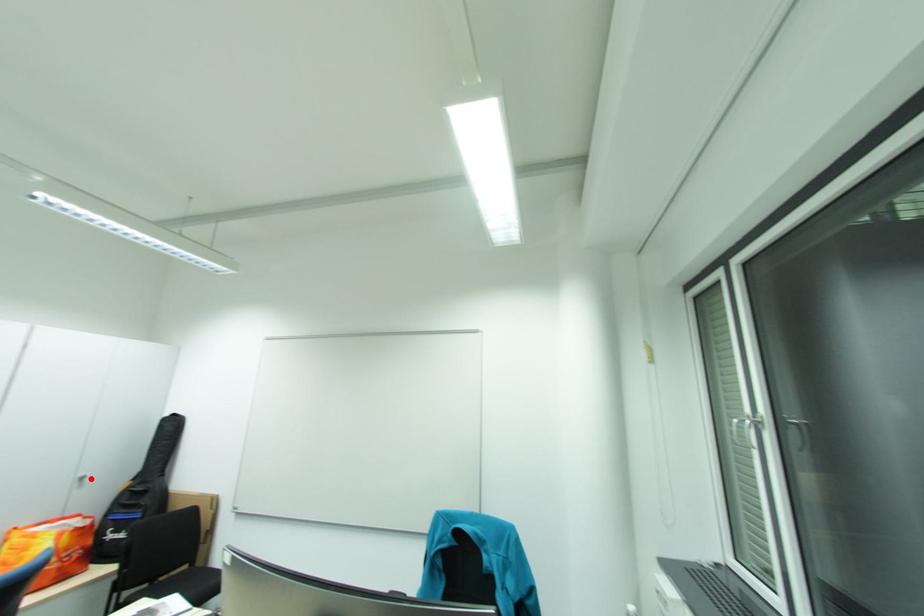
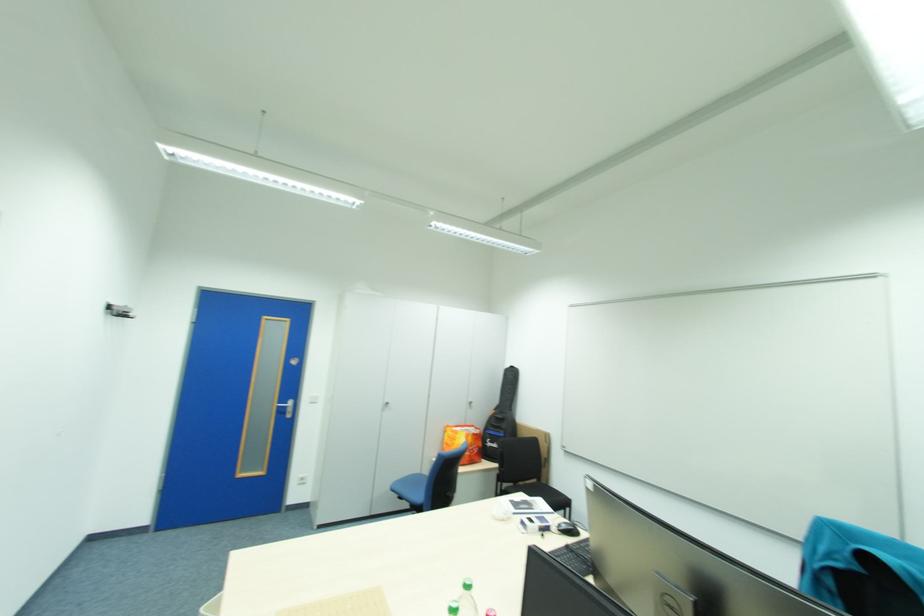
Question: A red point is marked in image1. In image2, is the corresponding 3D point closer to the camera or farther? Reply with the corresponding letter.

Choices:
 (A) The corresponding 3D point is closer.
 (B) The corresponding 3D point is farther.

Answer: (B)